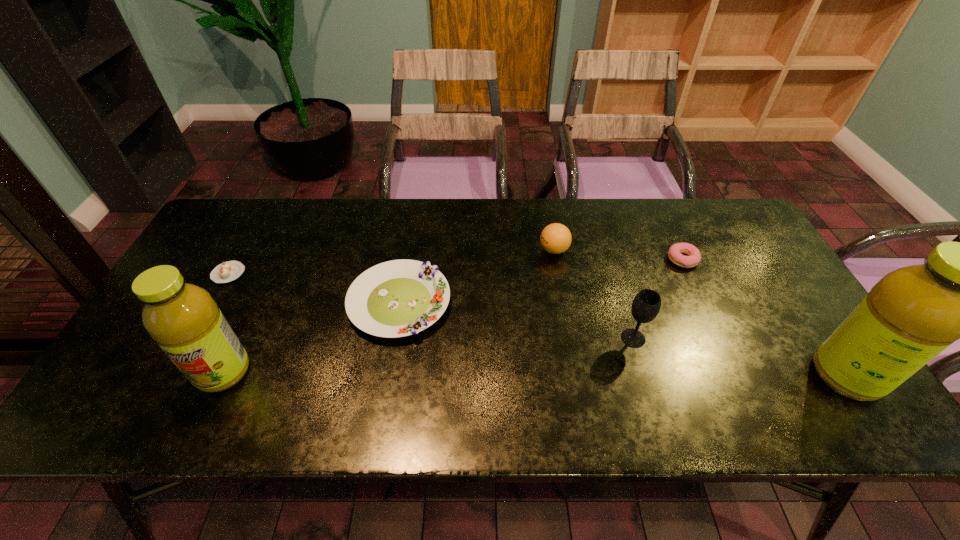
Where is `the shorter fruit juice`? The width and height of the screenshot is (960, 540). the shorter fruit juice is located at coordinates (182, 318).

The height and width of the screenshot is (540, 960). I want to click on the left fruit juice, so click(x=182, y=318).

The image size is (960, 540). What are the coordinates of `the taller fruit juice` in the screenshot? It's located at (912, 314).

The width and height of the screenshot is (960, 540). I want to click on the right fruit juice, so click(912, 314).

Locate an element on the screen. Image resolution: width=960 pixels, height=540 pixels. doughnut is located at coordinates (694, 257).

At what (x,y) coordinates should I click in order to perform the action: click on ping-pong ball. Please return your answer as a coordinate pair (x, y). Image resolution: width=960 pixels, height=540 pixels. Looking at the image, I should click on (555, 238).

Find the location of a particular element. This screenshot has height=540, width=960. the fourth tallest object is located at coordinates (555, 238).

In order to click on the leftmost object in this screenshot , I will do `click(228, 271)`.

Locate an element on the screen. The image size is (960, 540). the third object from right to left is located at coordinates (646, 305).

The image size is (960, 540). Identify the location of the fifth shortest object. (646, 305).